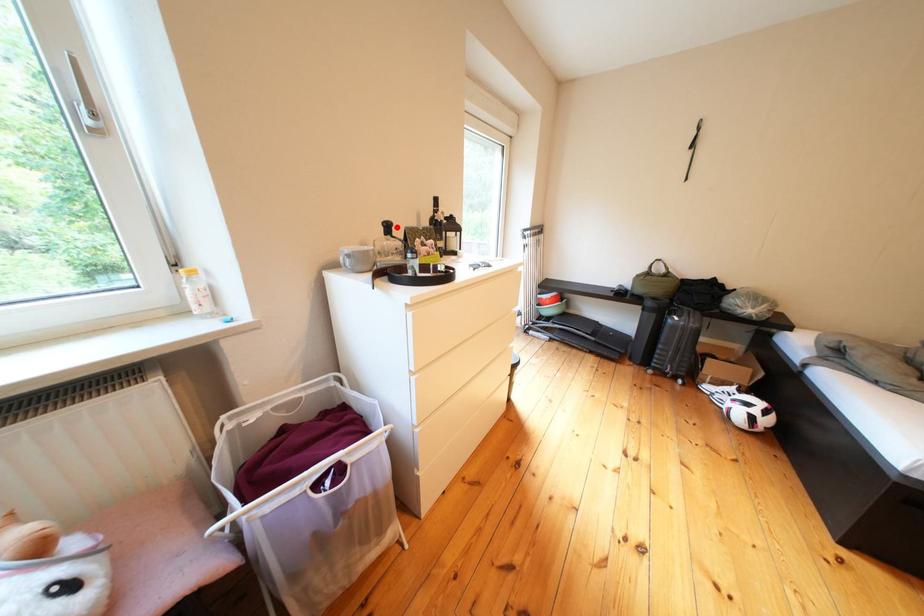
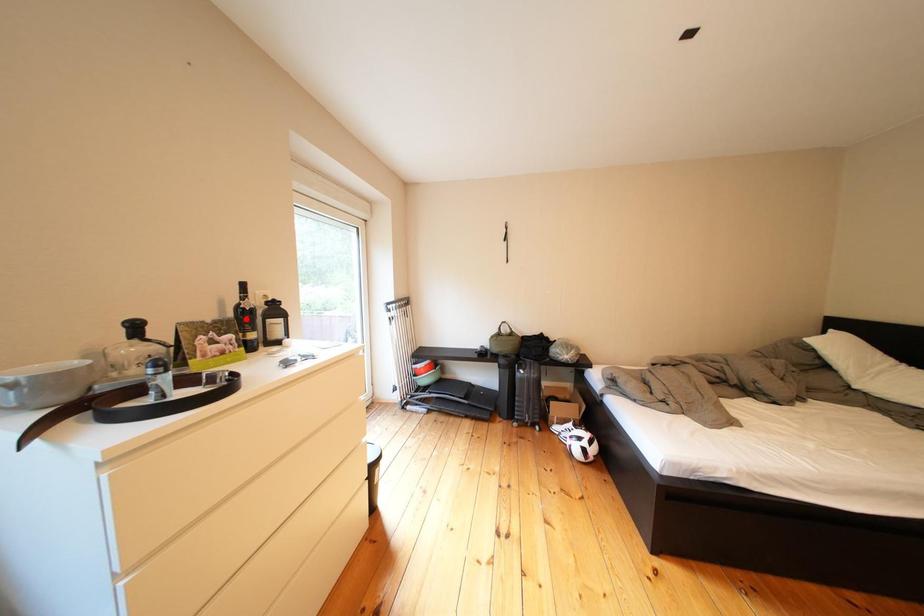
I am providing you with two images of the same scene from different viewpoints. A red point is marked on the first image and another point is marked on the second image. Is the marked point in image1 the same physical position as the marked point in image2?

No